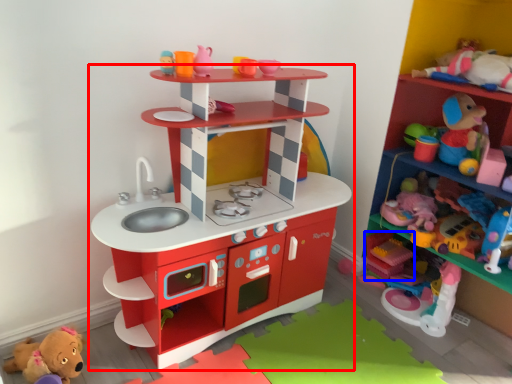
Question: Which of the following is the farthest to the observer, shelf (highlighted by a red box) or toy (highlighted by a blue box)?

Choices:
 (A) shelf
 (B) toy

Answer: (B)